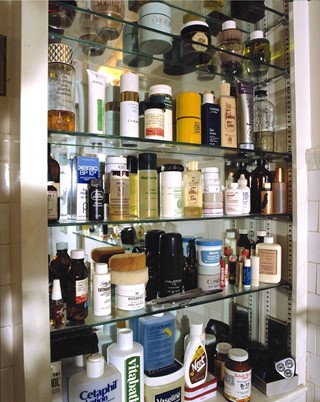
Where is `groups of bottles`? The width and height of the screenshot is (320, 402). groups of bottles is located at coordinates (191, 121), (187, 187), (177, 254), (174, 363), (99, 393).